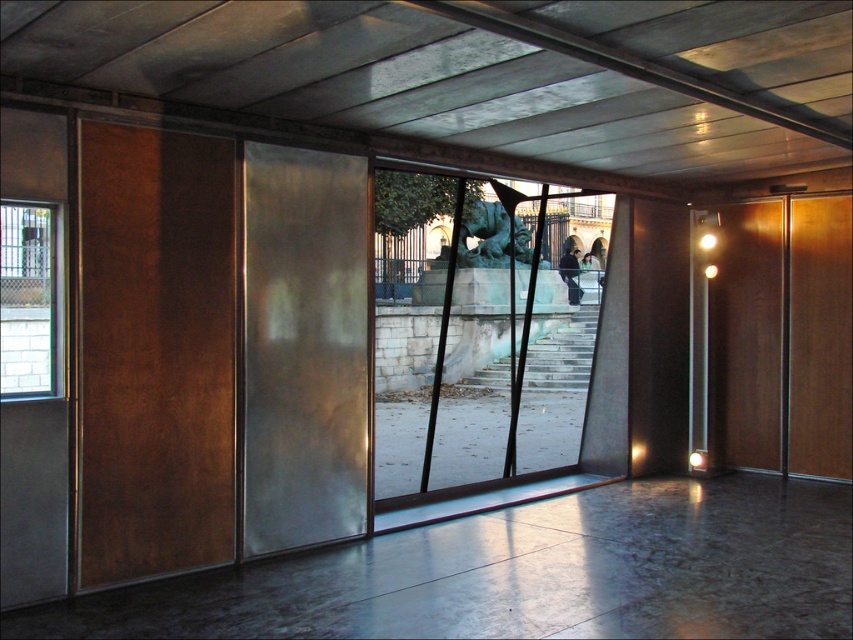
Question: Can you confirm if rustic wood screen door at left is bigger than dark gray fabric jacket at center?

Choices:
 (A) yes
 (B) no

Answer: (A)

Question: Which point appears closest to the camera in this image?

Choices:
 (A) (575, 259)
 (B) (260, 532)
 (C) (166, 156)
 (D) (494, 228)

Answer: (C)

Question: Among these objects, which one is farthest from the camera?

Choices:
 (A) dark gray fabric jacket at center
 (B) transparent glass door at center
 (C) rustic wood screen door at left
 (D) satin silver door at center

Answer: (A)

Question: Is rustic wood screen door at left wider than bronze statue at center?

Choices:
 (A) no
 (B) yes

Answer: (A)

Question: Is transparent glass door at center thinner than clear glass window at left?

Choices:
 (A) no
 (B) yes

Answer: (A)

Question: Estimate the real-world distances between objects in this image. Which object is farther from the clear glass window at left?

Choices:
 (A) transparent glass door at center
 (B) dark gray fabric jacket at center

Answer: (B)